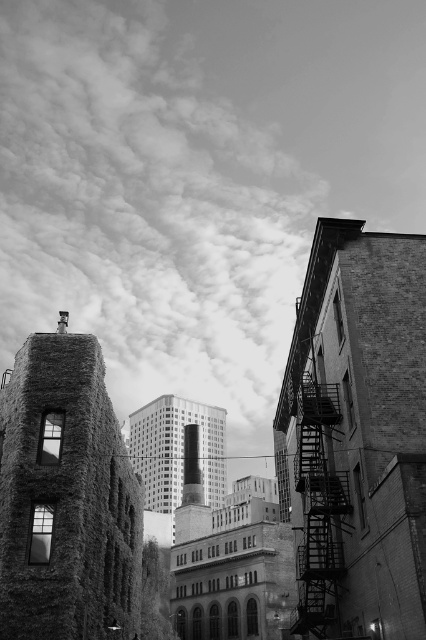
Question: Is rustic stone tower at left wider than smooth concrete building at center?

Choices:
 (A) no
 (B) yes

Answer: (A)

Question: Which point is farther from the camera taking this photo?

Choices:
 (A) (351, 275)
 (B) (310, 593)
 (C) (57, 612)

Answer: (B)

Question: Which point is closer to the camera?

Choices:
 (A) (365, 289)
 (B) (26, 177)

Answer: (A)

Question: From the image, what is the correct spatial relationship of brick wall at right in relation to rustic stone tower at left?

Choices:
 (A) below
 (B) above

Answer: (A)

Question: Can you confirm if brick wall at right is positioned above rustic stone tower at left?

Choices:
 (A) no
 (B) yes

Answer: (A)

Question: Estimate the real-world distances between objects in this image. Which object is farther from the cloudy sky at upper center?

Choices:
 (A) metallic fire escape at right
 (B) rustic stone tower at left
 (C) brick wall at right

Answer: (A)